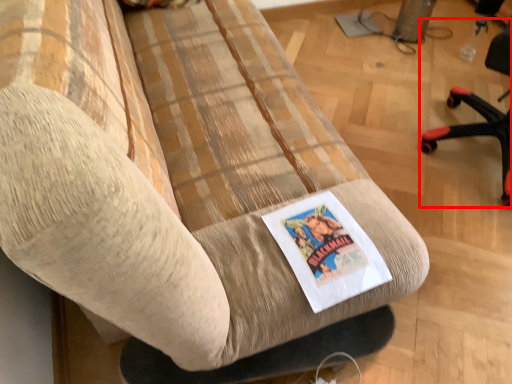
Question: Observing the image, what is the correct spatial positioning of chair (annotated by the red box) in reference to flyer?

Choices:
 (A) right
 (B) left

Answer: (A)